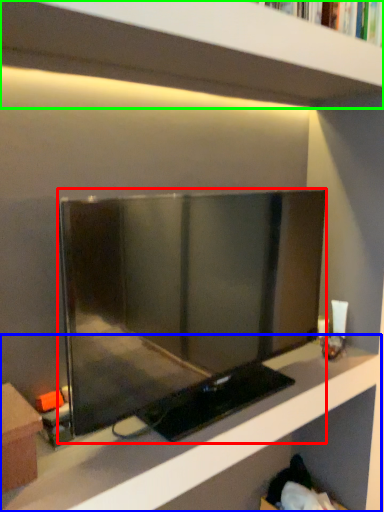
Question: Considering the real-world distances, which object is farthest from television (highlighted by a red box)? shelf (highlighted by a blue box) or shelf (highlighted by a green box)?

Choices:
 (A) shelf
 (B) shelf

Answer: (B)